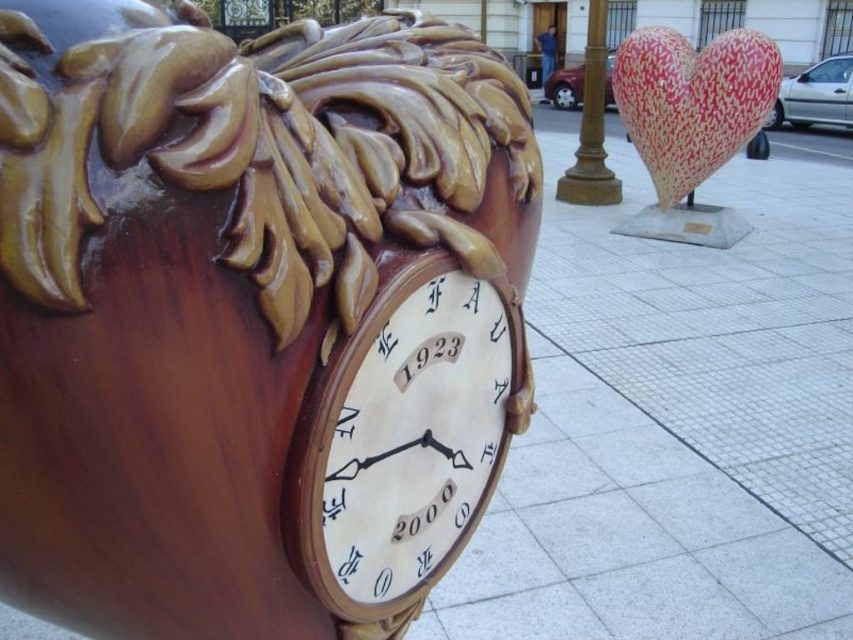
You are an architect designing a new plaza and want to place a clock in the center. You have two options from the image, the polished wood clock at center and the matte brown clock at center. Which one is placed above the other in the image?

The polished wood clock at center is positioned over the matte brown clock at center in the image.

You are standing in front of the clock at the plaza. There is a polished wood clock at center marked by point (253,316). If you walk straight ahead, will you walk towards the clock?

Yes, because the point (253,316) marks the location of the polished wood clock at center, so walking straight ahead would lead you directly toward it.

From the picture: You are standing in front of the clock and want to touch the closest one between the polished wood clock at center and the matte brown clock at center. Which one should you reach for?

The polished wood clock at center is closer to the viewer than the matte brown clock at center, so you should reach for the polished wood clock at center.